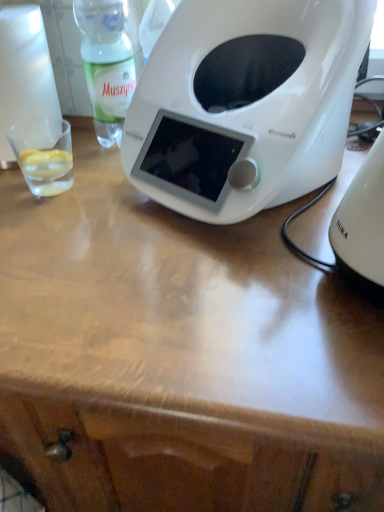
What do you see at coordinates (107, 63) in the screenshot? I see `green translucent bottle at upper left` at bounding box center [107, 63].

What is the approximate width of white plastic toaster at center?

white plastic toaster at center is 11.71 inches in width.

The height and width of the screenshot is (512, 384). Describe the element at coordinates (24, 74) in the screenshot. I see `white paper towel at left` at that location.

This screenshot has height=512, width=384. In order to click on white plastic kettle at right in this screenshot , I will do (362, 227).

What do you see at coordinates (362, 227) in the screenshot?
I see `white plastic kettle at right` at bounding box center [362, 227].

In order to click on transparent glass at left in this screenshot , I will do `click(44, 155)`.

Identify the location of green translucent bottle at upper left. This screenshot has height=512, width=384. (107, 63).

From the image's perspective, which is below, white plastic kettle at right or white paper towel at left?

white plastic kettle at right, from the image's perspective.

Is white plastic kettle at right located outside white paper towel at left?

Yes, white plastic kettle at right is outside of white paper towel at left.

In the scene shown: Does white plastic kettle at right have a larger size compared to white paper towel at left?

Actually, white plastic kettle at right might be smaller than white paper towel at left.

Does white plastic kettle at right appear on the left side of white paper towel at left?

No.

Considering the relative sizes of transparent glass at left and white paper towel at left in the image provided, is transparent glass at left wider than white paper towel at left?

No.

From the picture: From a real-world perspective, is transparent glass at left beneath white paper towel at left?

Yes.

Find the location of a particular element. Image resolution: width=384 pixels, height=512 pixels. paper towel above the transparent glass at left (from the image's perspective) is located at coordinates (24, 74).

Is white paper towel at left at the back of transparent glass at left?

No, transparent glass at left is not facing the opposite direction of white paper towel at left.

From the image's perspective, which one is positioned higher, green translucent bottle at upper left or white plastic kettle at right?

green translucent bottle at upper left, from the image's perspective.

Would you say green translucent bottle at upper left is inside or outside white plastic kettle at right?

green translucent bottle at upper left exists outside the volume of white plastic kettle at right.

In the scene shown: Is green translucent bottle at upper left positioned with its back to white plastic kettle at right?

No, green translucent bottle at upper left is not facing the opposite direction of white plastic kettle at right.

From a real-world perspective, is green translucent bottle at upper left physically located above or below white plastic kettle at right?

Clearly, from a real-world perspective, green translucent bottle at upper left is above white plastic kettle at right.

Which is more to the left, green translucent bottle at upper left or white plastic toaster at center?

From the viewer's perspective, green translucent bottle at upper left appears more on the left side.

Considering the sizes of objects green translucent bottle at upper left and white plastic toaster at center in the image provided, who is wider, green translucent bottle at upper left or white plastic toaster at center?

white plastic toaster at center.

Is green translucent bottle at upper left positioned far away from white plastic toaster at center?

No, green translucent bottle at upper left is not far away from white plastic toaster at center.

From a real-world perspective, which is physically below, white plastic toaster at center or white plastic kettle at right?

From a 3D spatial view, white plastic kettle at right is below.

Is white plastic toaster at center oriented away from white plastic kettle at right?

No, white plastic toaster at center is not facing the opposite direction of white plastic kettle at right.

Is white plastic toaster at center completely or partially outside of white plastic kettle at right?

Yes, white plastic toaster at center is not within white plastic kettle at right.

From the image's perspective, which one is positioned higher, white plastic toaster at center or white plastic kettle at right?

white plastic toaster at center appears higher in the image.

Does transparent glass at left contain white plastic toaster at center?

No, white plastic toaster at center is not inside transparent glass at left.

From the image's perspective, between transparent glass at left and white plastic toaster at center, who is located below?

transparent glass at left is shown below in the image.

Which point is more distant from viewer, (49, 179) or (226, 197)?

Point (49, 179)

Which is in front, transparent glass at left or green translucent bottle at upper left?

Positioned in front is green translucent bottle at upper left.

Which object is positioned more to the left, transparent glass at left or green translucent bottle at upper left?

From the viewer's perspective, transparent glass at left appears more on the left side.

Is transparent glass at left far away from green translucent bottle at upper left?

Actually, transparent glass at left and green translucent bottle at upper left are a little close together.

Is transparent glass at left bigger than green translucent bottle at upper left?

Incorrect, transparent glass at left is not larger than green translucent bottle at upper left.

Where is `paper towel that is above the white plastic kettle at right (from the image's perspective)`? The image size is (384, 512). paper towel that is above the white plastic kettle at right (from the image's perspective) is located at coordinates (24, 74).

At what (x,y) coordinates should I click in order to perform the action: click on coffee cup on the right of white paper towel at left. Please return your answer as a coordinate pair (x, y). The width and height of the screenshot is (384, 512). Looking at the image, I should click on (44, 155).

Considering their positions, is green translucent bottle at upper left positioned further to white paper towel at left than white plastic toaster at center?

Based on the image, white plastic toaster at center appears to be further to white paper towel at left.

Considering their positions, is white plastic kettle at right positioned further to white paper towel at left than transparent glass at left?

white plastic kettle at right is positioned further to the anchor white paper towel at left.

Estimate the real-world distances between objects in this image. Which object is closer to white plastic kettle at right, green translucent bottle at upper left or white paper towel at left?

green translucent bottle at upper left is closer to white plastic kettle at right.

From the image, which object appears to be farther from white plastic toaster at center, white paper towel at left or transparent glass at left?

white paper towel at left lies further to white plastic toaster at center than the other object.

Estimate the real-world distances between objects in this image. Which object is closer to white paper towel at left, green translucent bottle at upper left or white plastic kettle at right?

Based on the image, green translucent bottle at upper left appears to be nearer to white paper towel at left.

Looking at the image, which one is located further to green translucent bottle at upper left, transparent glass at left or white plastic toaster at center?

Among the two, white plastic toaster at center is located further to green translucent bottle at upper left.

Which object lies further to the anchor point white paper towel at left, white plastic kettle at right or green translucent bottle at upper left?

Among the two, white plastic kettle at right is located further to white paper towel at left.

Which object lies further to the anchor point white plastic kettle at right, transparent glass at left or white plastic toaster at center?

transparent glass at left.

Locate an element on the screen. Image resolution: width=384 pixels, height=512 pixels. toaster between white paper towel at left and white plastic kettle at right in the horizontal direction is located at coordinates (245, 103).

Where is `coffee cup situated between white paper towel at left and white plastic kettle at right from left to right`? coffee cup situated between white paper towel at left and white plastic kettle at right from left to right is located at coordinates (44, 155).

Where is `toaster situated between transparent glass at left and white plastic kettle at right from left to right`? toaster situated between transparent glass at left and white plastic kettle at right from left to right is located at coordinates (245, 103).

You are a GUI agent. You are given a task and a screenshot of the screen. Output one action in this format:
    pyautogui.click(x=<x>, y=<y>)
    Task: Click on the bottle between transparent glass at left and white plastic toaster at center in the horizontal direction
    The width and height of the screenshot is (384, 512).
    Given the screenshot: What is the action you would take?
    [107, 63]